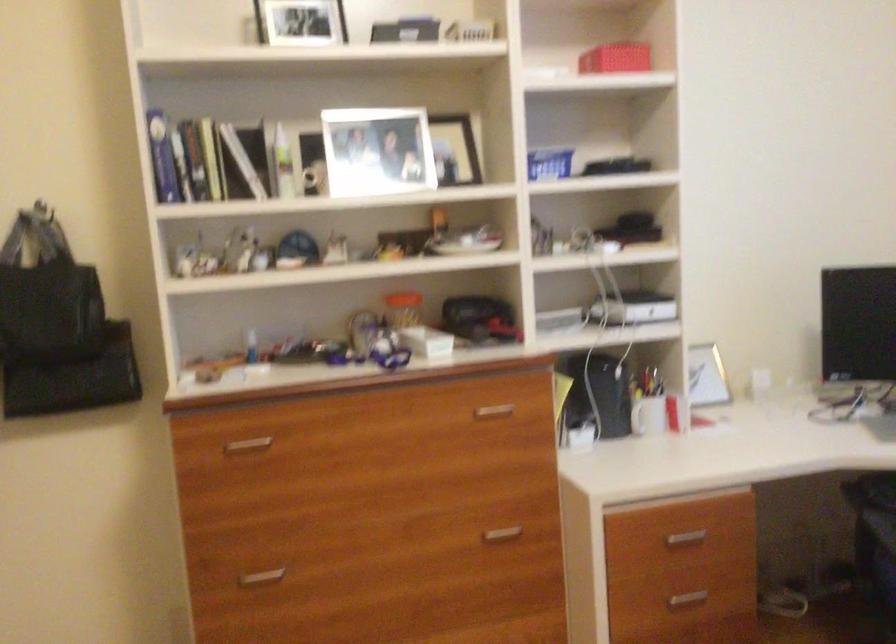
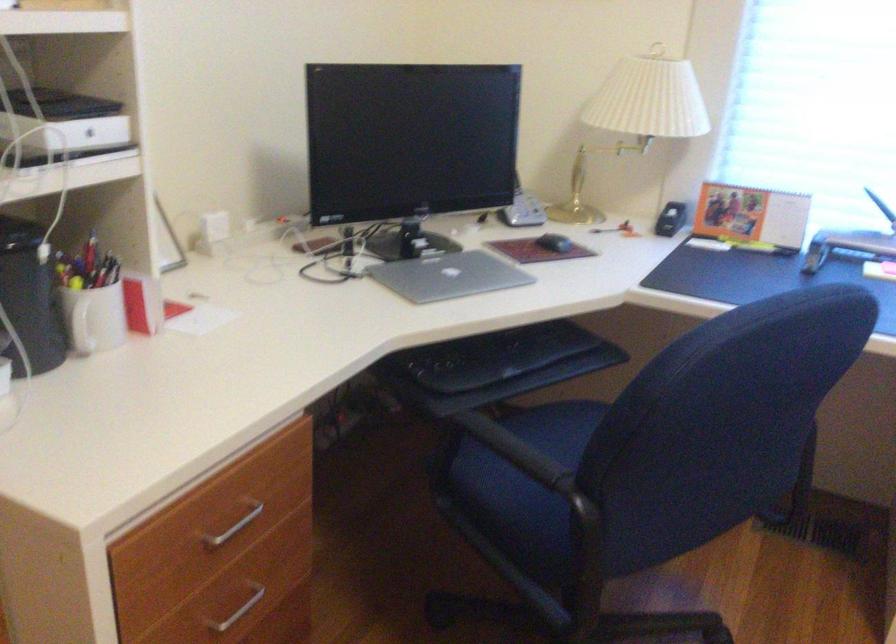
Where in the second image is the point corresponding to point (636, 418) from the first image?

(82, 328)